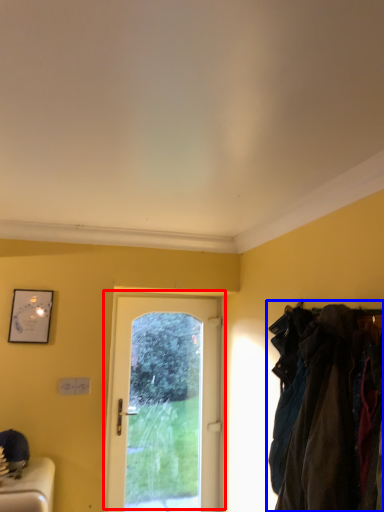
Question: Which object is closer to the camera taking this photo, door (highlighted by a red box) or laundry (highlighted by a blue box)?

Choices:
 (A) door
 (B) laundry

Answer: (B)